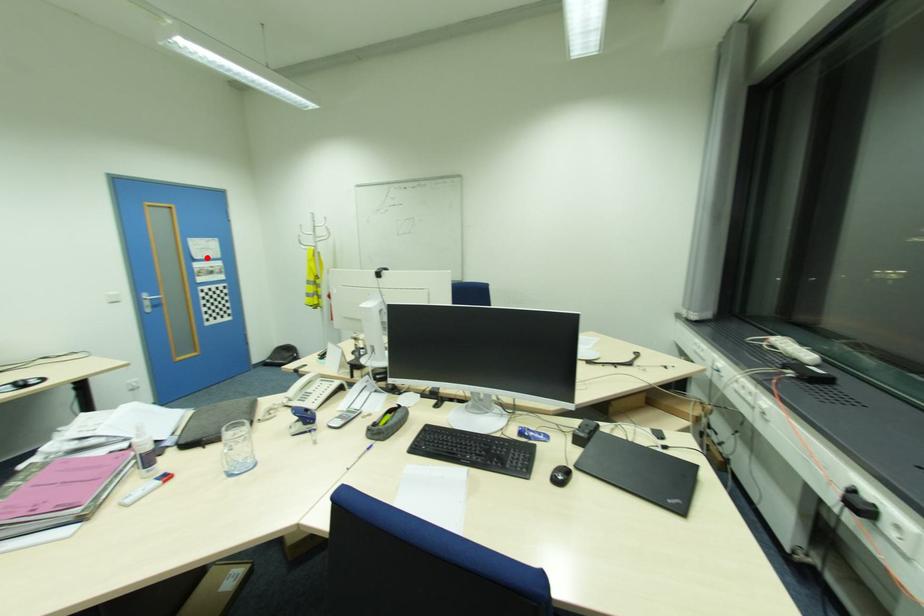
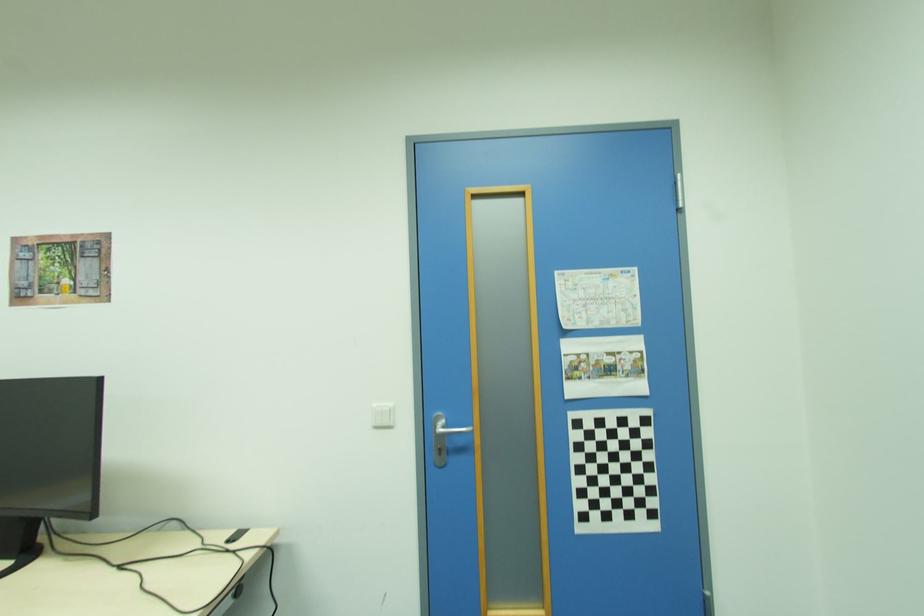
Question: I am providing you with two images of the same scene from different viewpoints. A red point is marked on the first image. Can you still see the location of the red point in image 2?

Choices:
 (A) Yes
 (B) No

Answer: (A)